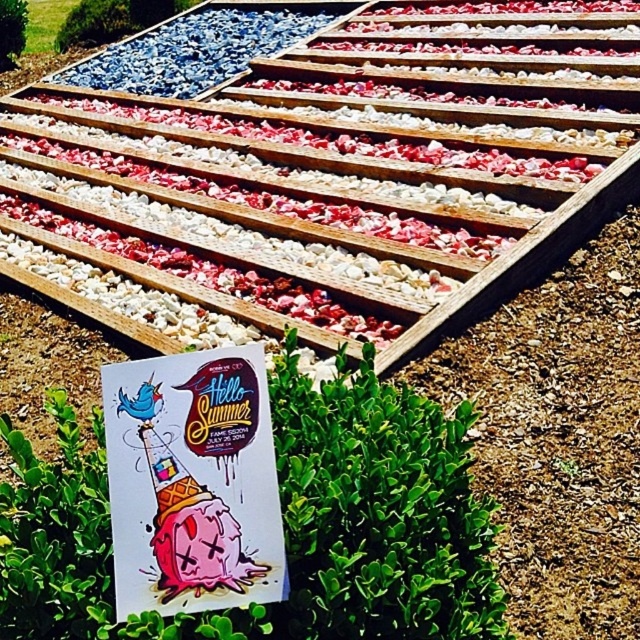
You are standing at the point labeled point (284,524) in the garden. Where are you located relative to the green leafy bush at center?

The point (284,524) is on the green leafy bush at center, so you are standing on the green leafy bush at center.